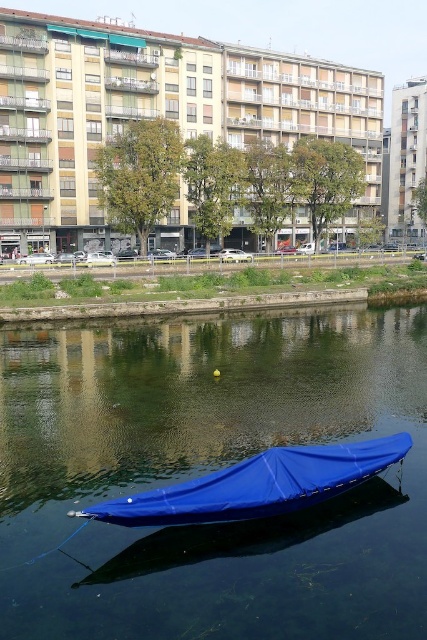
You are standing at the center of the image and want to locate the blue fabric boat at lower center. According to the coordinates provided, in which direction should you move to find it?

The blue fabric boat at lower center is located at coordinates point (207, 472). Since you are at the center, you should move to the lower right direction to find it.